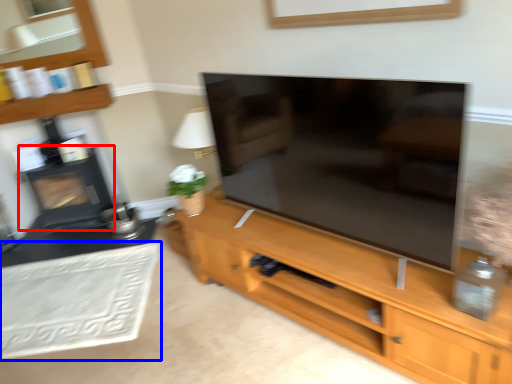
Question: Which object appears farthest to the camera in this image, fireplace (highlighted by a red box) or plain (highlighted by a blue box)?

Choices:
 (A) fireplace
 (B) plain

Answer: (A)